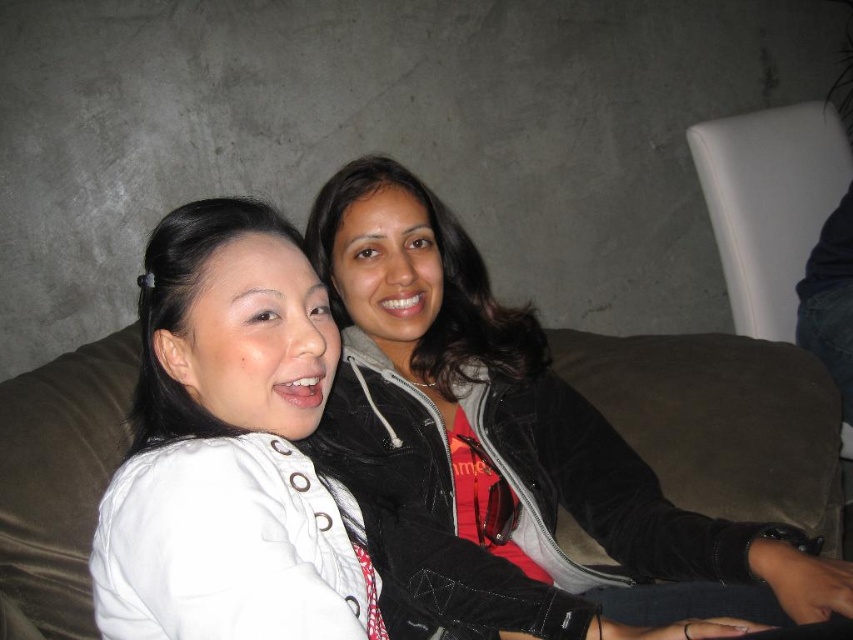
Question: Does black velvet jacket at center have a smaller size compared to white matte jacket at left?

Choices:
 (A) no
 (B) yes

Answer: (A)

Question: Is black velvet jacket at center positioned behind white matte jacket at left?

Choices:
 (A) yes
 (B) no

Answer: (A)

Question: Can you confirm if black velvet jacket at center is positioned to the right of white matte jacket at left?

Choices:
 (A) yes
 (B) no

Answer: (A)

Question: Among these objects, which one is farthest from the camera?

Choices:
 (A) black velvet jacket at center
 (B) white matte jacket at left

Answer: (A)

Question: Which point is closer to the camera taking this photo?

Choices:
 (A) pos(199,326)
 (B) pos(647,596)

Answer: (A)